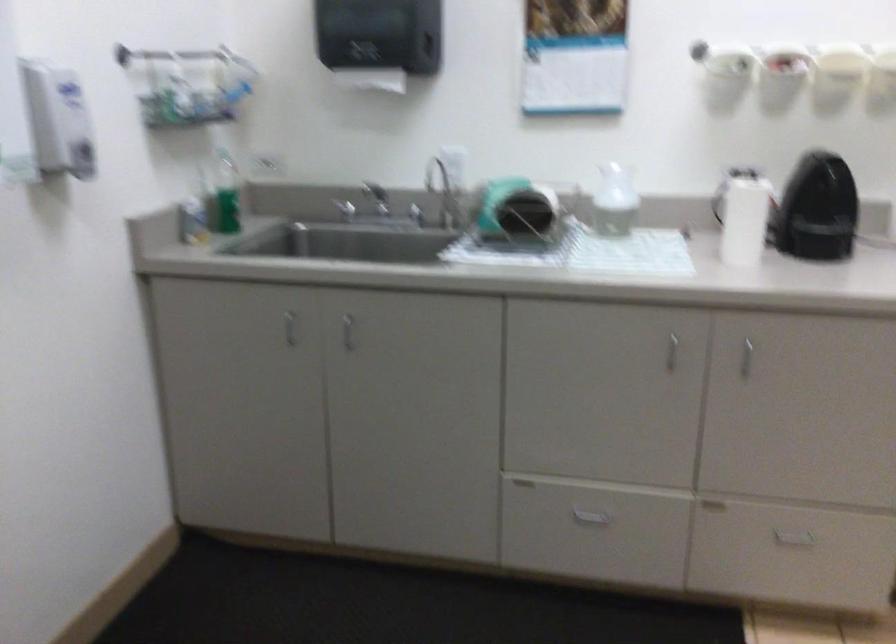
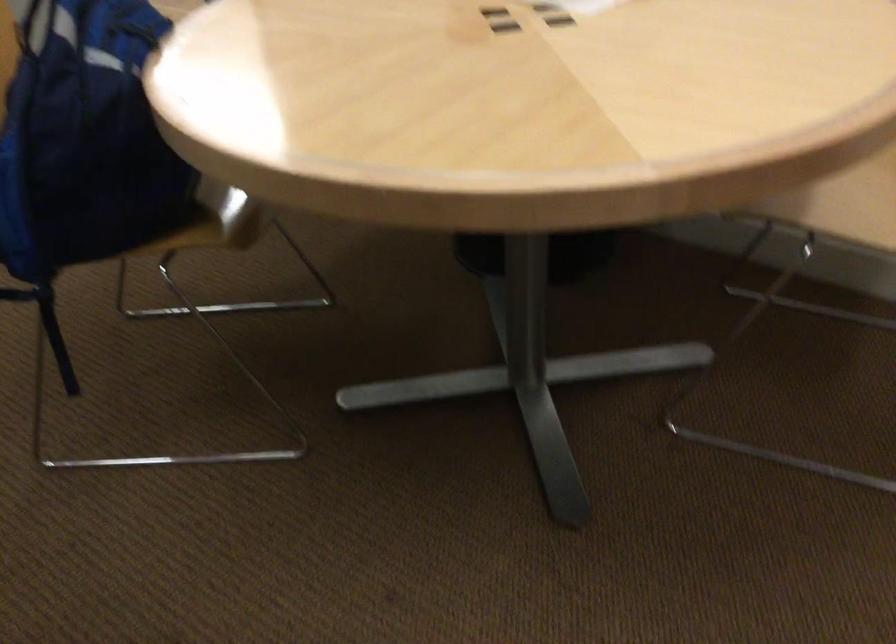
How did the camera likely rotate?

The camera rotated toward left-down.